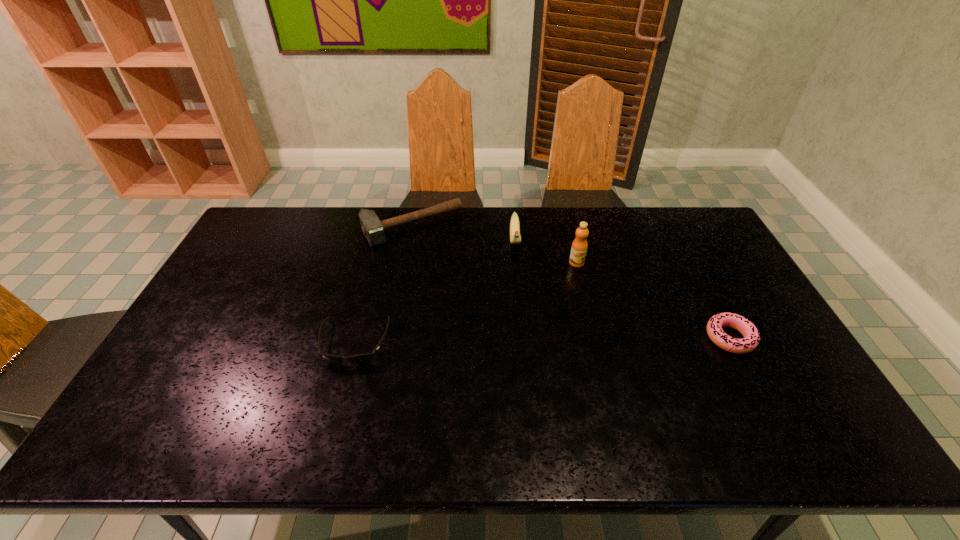
This screenshot has width=960, height=540. What are the coordinates of `vacant space on the desktop that is between the sunglasses and the rightmost object and is positioned at the stem of the second tallest object` in the screenshot? It's located at (519, 340).

What are the coordinates of `vacant spot on the desktop that is between the sunglasses and the rightmost object and is positioned on the front label of the second object from right to left` in the screenshot? It's located at (599, 339).

Locate an element on the screen. Image resolution: width=960 pixels, height=540 pixels. free space on the desktop that is between the sunglasses and the rightmost object and is positioned on the striking surface of the hammer is located at coordinates (490, 341).